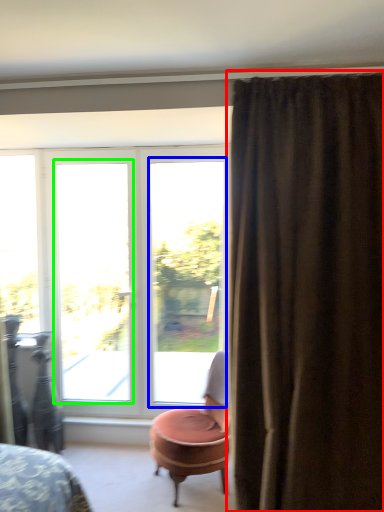
Question: Based on their relative distances, which object is nearer to curtain (highlighted by a red box)? Choose from window (highlighted by a blue box) and window (highlighted by a green box).

Choices:
 (A) window
 (B) window

Answer: (A)